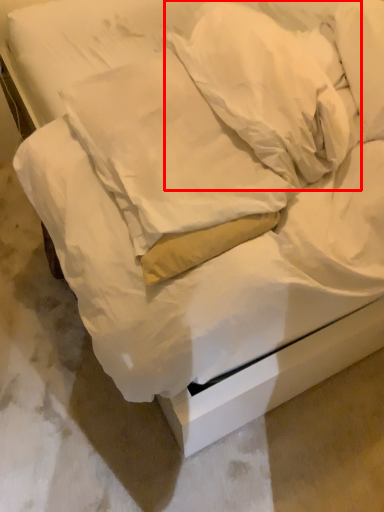
Question: From the image's perspective, where is pillow (annotated by the red box) located in relation to pillow in the image?

Choices:
 (A) above
 (B) below

Answer: (A)